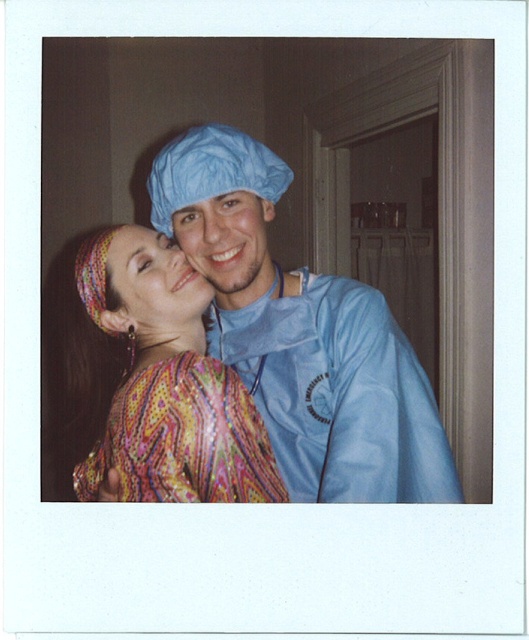
Question: Is blue matte surgical gown at center thinner than printed fabric dress at center?

Choices:
 (A) no
 (B) yes

Answer: (A)

Question: Does multicolored patterned dress at center have a lesser width compared to multicolored fabric at center?

Choices:
 (A) no
 (B) yes

Answer: (A)

Question: Which object is closer to the camera taking this photo?

Choices:
 (A) blue fabric face at center
 (B) multicolored patterned dress at center
 (C) printed fabric dress at center
 (D) blue matte surgical gown at center

Answer: (B)

Question: Can you confirm if multicolored patterned dress at center is bigger than multicolored fabric at center?

Choices:
 (A) no
 (B) yes

Answer: (B)

Question: Which object appears closest to the camera in this image?

Choices:
 (A) blue fabric face at center
 (B) blue matte surgical gown at center
 (C) multicolored patterned dress at center

Answer: (C)

Question: Estimate the real-world distances between objects in this image. Which object is farther from the blue matte surgical gown at center?

Choices:
 (A) printed fabric dress at center
 (B) multicolored fabric at center
 (C) multicolored patterned dress at center
 (D) blue fabric face at center

Answer: (A)